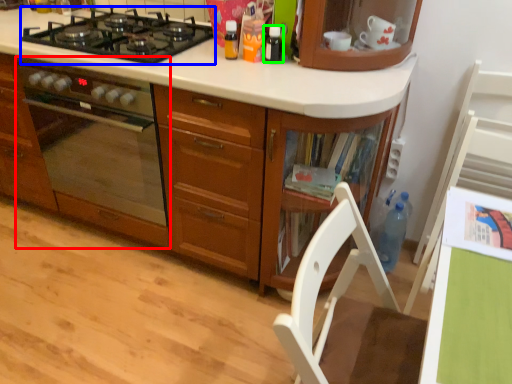
Question: Which object is the farthest from home appliance (highlighted by a red box)? Choose among these: gas stove (highlighted by a blue box) or kitchen appliance (highlighted by a green box).

Choices:
 (A) gas stove
 (B) kitchen appliance

Answer: (B)